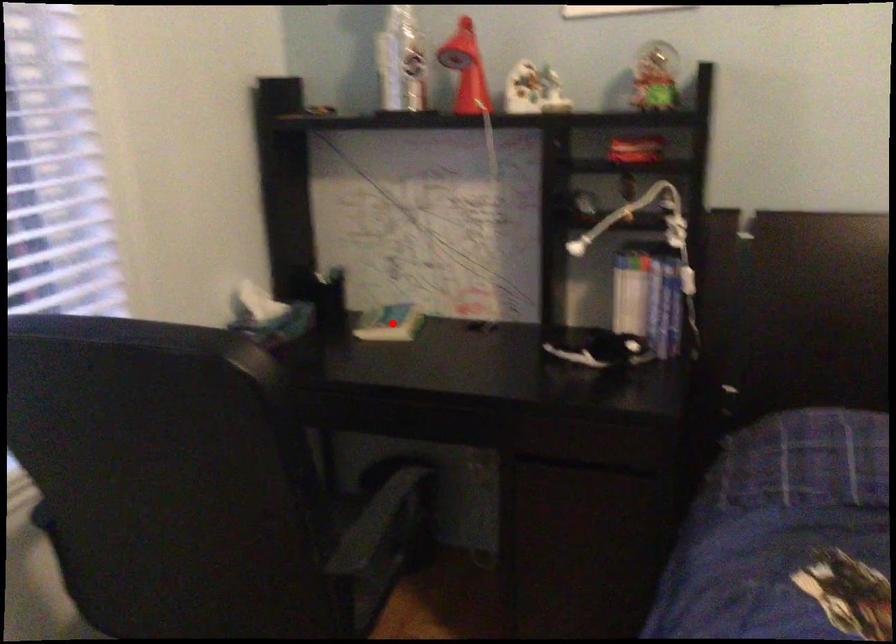
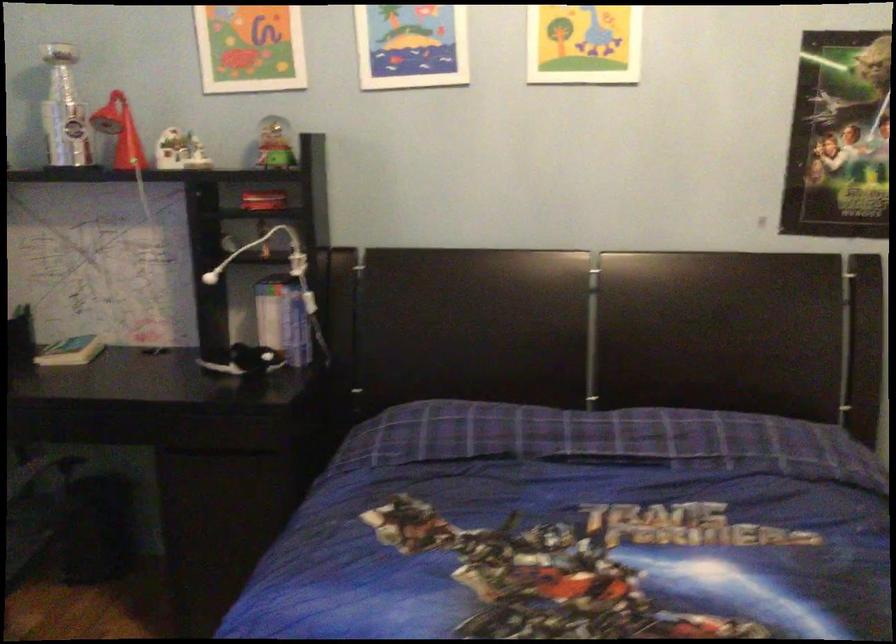
Question: A red point is marked in image1. In image2, is the corresponding 3D point closer to the camera or farther? Reply with the corresponding letter.

Choices:
 (A) The corresponding 3D point is closer.
 (B) The corresponding 3D point is farther.

Answer: (B)